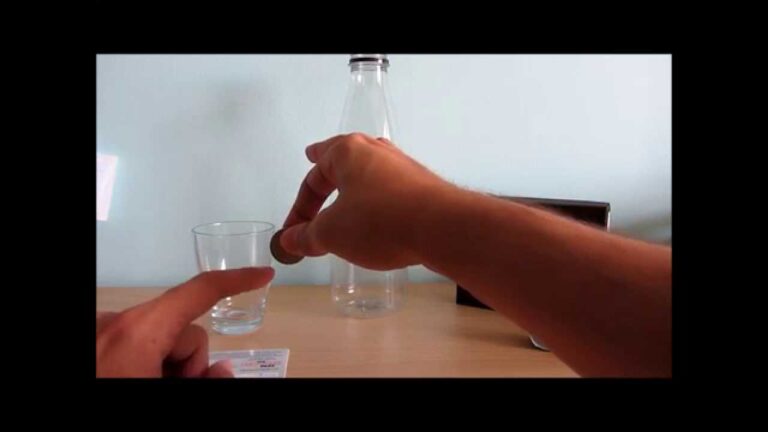
You are a GUI agent. You are given a task and a screenshot of the screen. Output one action in this format:
    pyautogui.click(x=<x>, y=<y>)
    Task: Click on the wooden desk
    This screenshot has width=768, height=432.
    Given the screenshot: What is the action you would take?
    tap(402, 336)